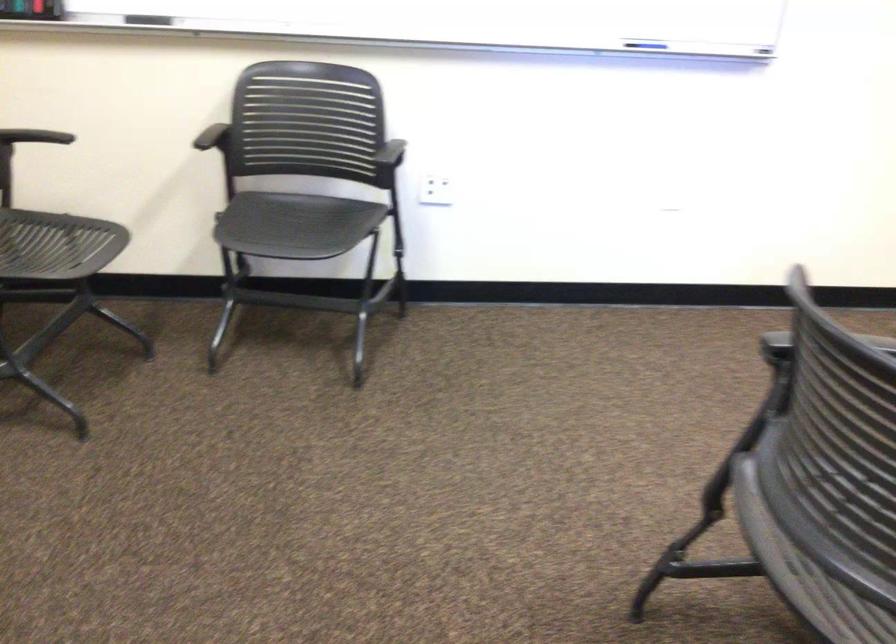
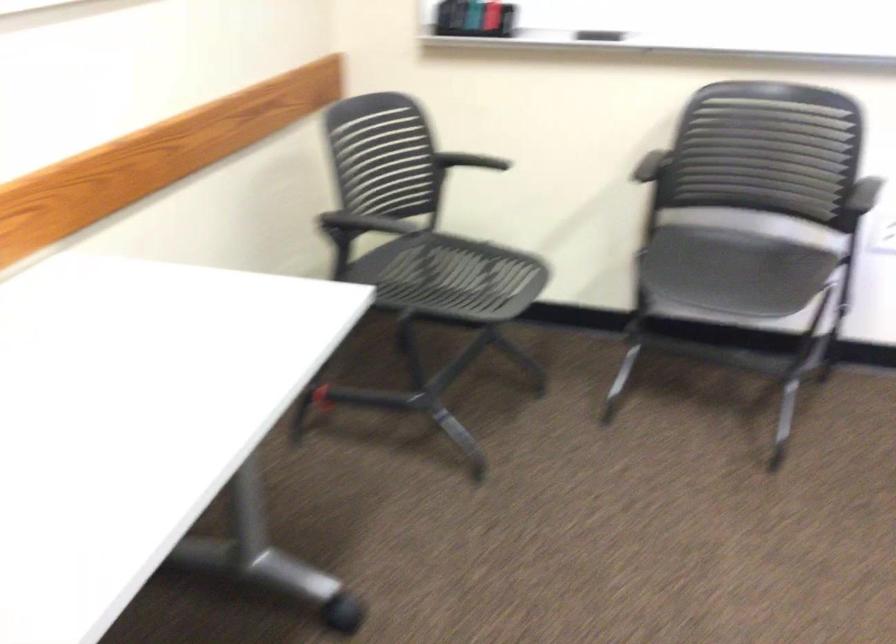
In the second image, find the point that corresponds to [218,135] in the first image.

(649, 166)